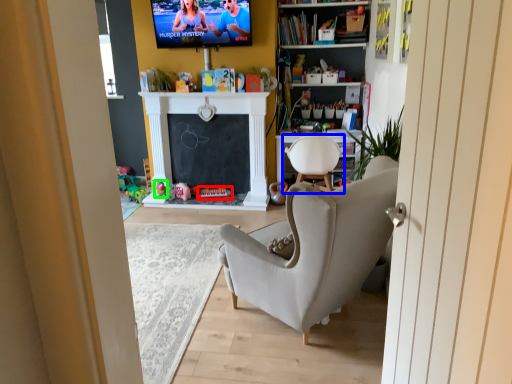
Question: Considering the real-world distances, which object is closest to toy (highlighted by a red box)? chair (highlighted by a blue box) or toy (highlighted by a green box).

Choices:
 (A) chair
 (B) toy

Answer: (B)